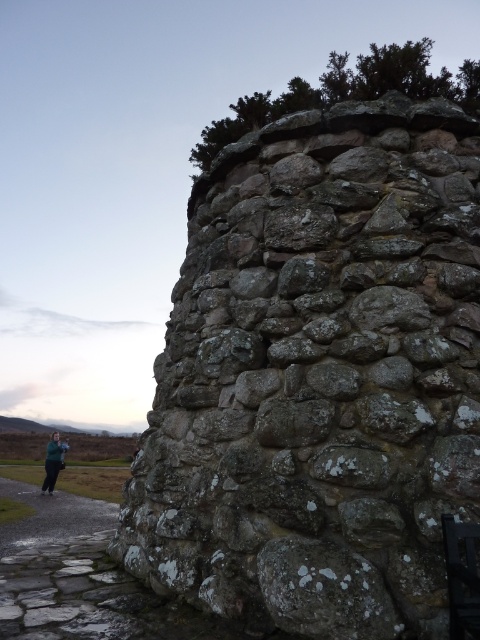
Can you confirm if lichen-covered stone at center is positioned to the left of green fabric jacket at lower left?

No, lichen-covered stone at center is not to the left of green fabric jacket at lower left.

Between lichen-covered stone at center and green fabric jacket at lower left, which one is positioned higher?

Positioned higher is lichen-covered stone at center.

Between point (282, 541) and point (54, 468), which one is positioned in front?

Point (282, 541)

I want to click on lichen-covered stone at center, so click(319, 376).